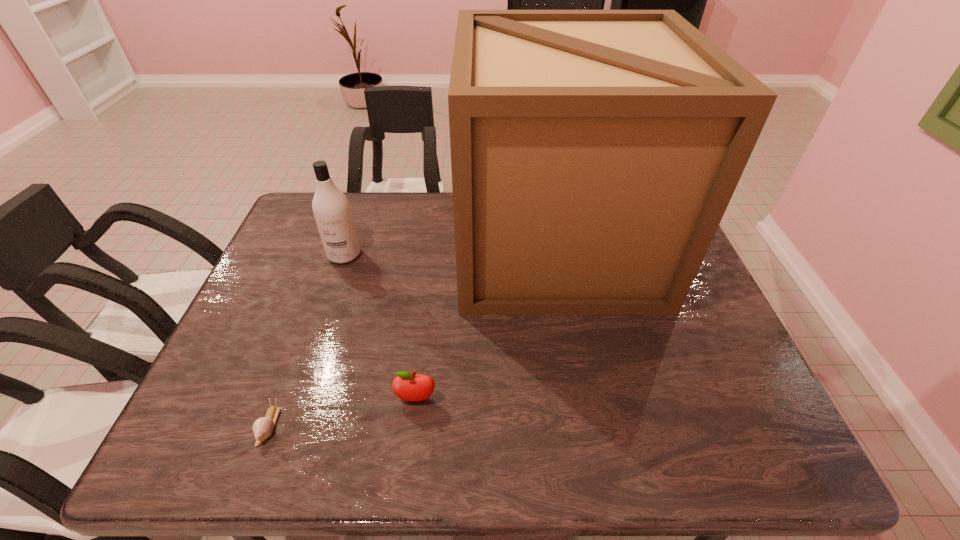
Locate an element on the screen. blank space at the left edge of the desktop is located at coordinates (282, 306).

Locate an element on the screen. vacant space at the right edge is located at coordinates (677, 374).

What are the coordinates of `free space at the far left corner of the desktop` in the screenshot? It's located at (309, 222).

You are a GUI agent. You are given a task and a screenshot of the screen. Output one action in this format:
    pyautogui.click(x=<x>, y=<y>)
    Task: Click on the free space between the shampoo and the escargot
    This screenshot has height=540, width=960.
    Given the screenshot: What is the action you would take?
    pyautogui.click(x=306, y=340)

Identify the location of empty space that is in between the second object from right to left and the shortest object. (343, 412).

This screenshot has height=540, width=960. What are the coordinates of `free space between the rightmost object and the shortest object` in the screenshot? It's located at (412, 335).

Image resolution: width=960 pixels, height=540 pixels. I want to click on empty space that is in between the shampoo and the box, so click(449, 249).

The height and width of the screenshot is (540, 960). I want to click on vacant space that is in between the escargot and the apple, so click(343, 412).

You are a GUI agent. You are given a task and a screenshot of the screen. Output one action in this format:
    pyautogui.click(x=<x>, y=<y>)
    Task: Click on the empty space between the shortest object and the second shortest object
    The height and width of the screenshot is (540, 960).
    Given the screenshot: What is the action you would take?
    pyautogui.click(x=343, y=412)

Locate an element on the screen. vacant region between the third tallest object and the rightmost object is located at coordinates (486, 321).